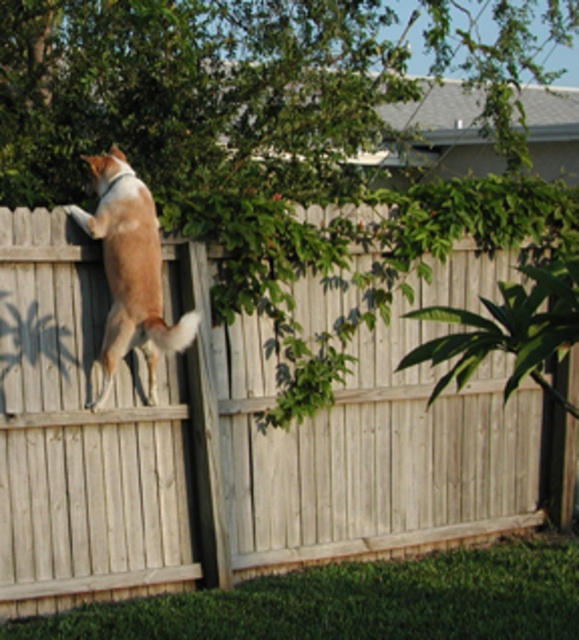
You are standing at the camera position and want to throw a ball to a point that is exactly 6 meters away. Is the point at coordinates point [324,525] within the backyard scene in the image a suitable target for your throw?

The point at coordinates point [324,525] is 5.96 meters away from the camera position, so yes, it is within the desired distance of 6 meters and can be a suitable target for your throw.

You are standing in the backyard and want to throw a ball to the dog. The dog is at point (42, 397). There is an obstacle at point (108, 216). Will the ball hit the obstacle before reaching the dog?

Point (42, 397) is behind point (108, 216), so the ball will hit the obstacle at point (108, 216) before reaching the dog at point (42, 397).